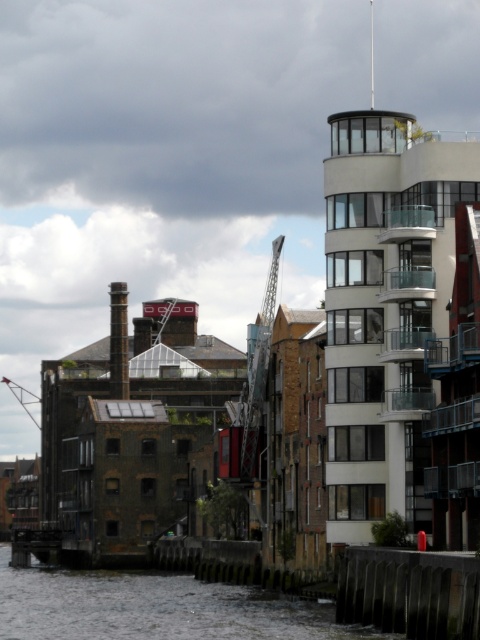
This screenshot has width=480, height=640. Find the location of `gray concrete river at lower left`. gray concrete river at lower left is located at coordinates (154, 609).

Does gray concrete river at lower left have a lesser width compared to metallic gray crane at left?

No, gray concrete river at lower left is not thinner than metallic gray crane at left.

Between point (316, 612) and point (24, 397), which one is positioned behind?

The point (24, 397) is more distant.

At what (x,y) coordinates should I click in order to perform the action: click on gray concrete river at lower left. Please return your answer as a coordinate pair (x, y). This screenshot has width=480, height=640. Looking at the image, I should click on (154, 609).